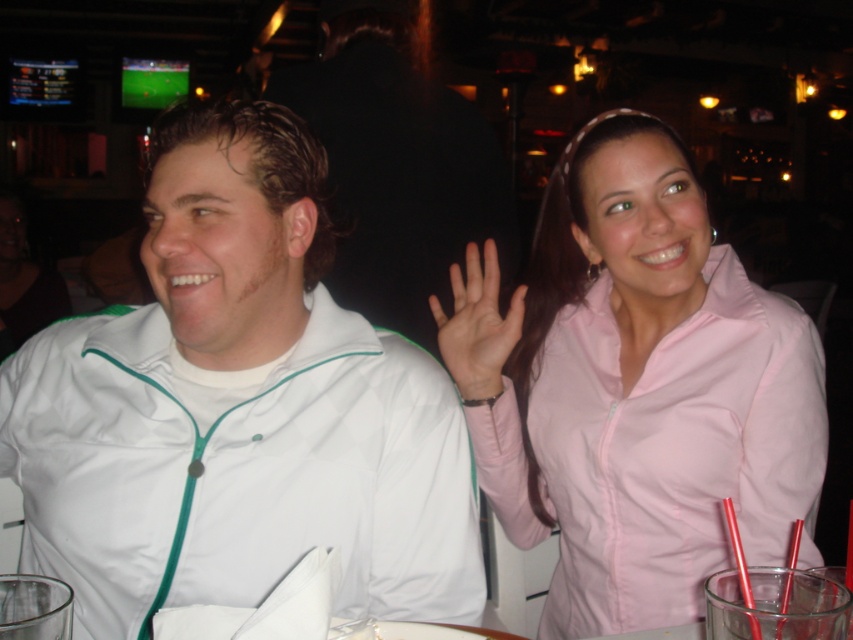
Is white matte jacket at left positioned in front of pink matte hand at center?

Yes, it is.

Measure the distance from white matte jacket at left to pink matte hand at center.

white matte jacket at left is 12.48 inches from pink matte hand at center.

Measure the distance between white matte jacket at left and camera.

The distance of white matte jacket at left from camera is 98.64 centimeters.

Identify the location of white matte jacket at left. The image size is (853, 640). (236, 408).

Is pink zip-up jacket at upper right closer to camera compared to pink matte hand at center?

Yes, it is.

Identify the location of pink zip-up jacket at upper right. The width and height of the screenshot is (853, 640). (634, 387).

You are a GUI agent. You are given a task and a screenshot of the screen. Output one action in this format:
    pyautogui.click(x=<x>, y=<y>)
    Task: Click on the pink zip-up jacket at upper right
    
    Given the screenshot: What is the action you would take?
    (634, 387)

Is white matte jacket at left taller than pink zip-up jacket at upper right?

Incorrect, white matte jacket at left's height is not larger of pink zip-up jacket at upper right's.

Can you confirm if white matte jacket at left is shorter than pink zip-up jacket at upper right?

Indeed, white matte jacket at left has a lesser height compared to pink zip-up jacket at upper right.

Which is in front, point (296, 416) or point (654, 193)?

Point (296, 416)

Locate an element on the screen. This screenshot has width=853, height=640. white matte jacket at left is located at coordinates (236, 408).